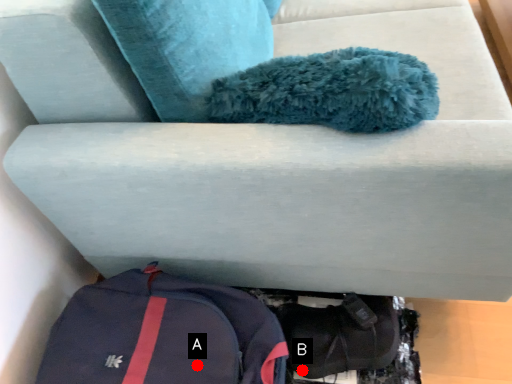
Question: Two points are circled on the image, labeled by A and B beside each circle. Which point is further to the camera?

Choices:
 (A) A is further
 (B) B is further

Answer: (B)